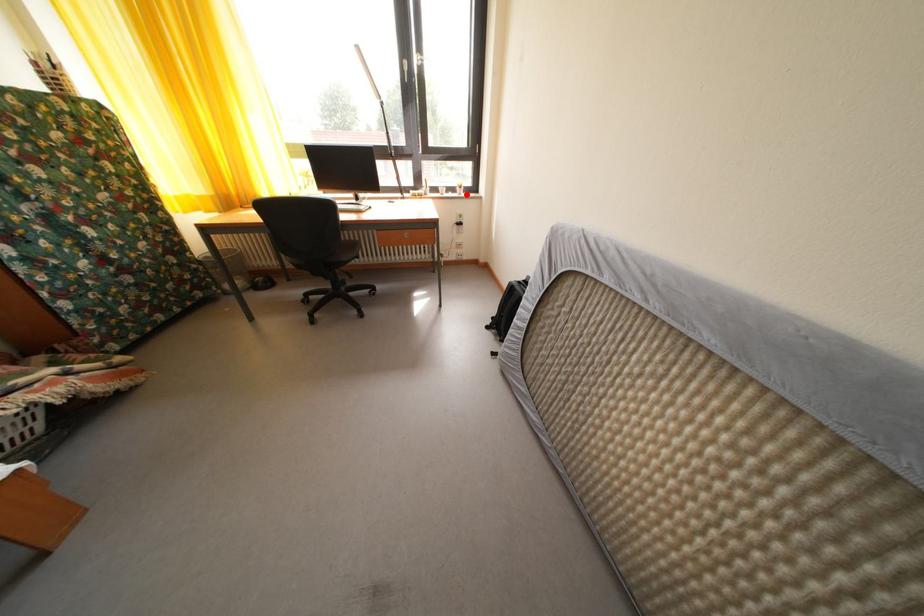
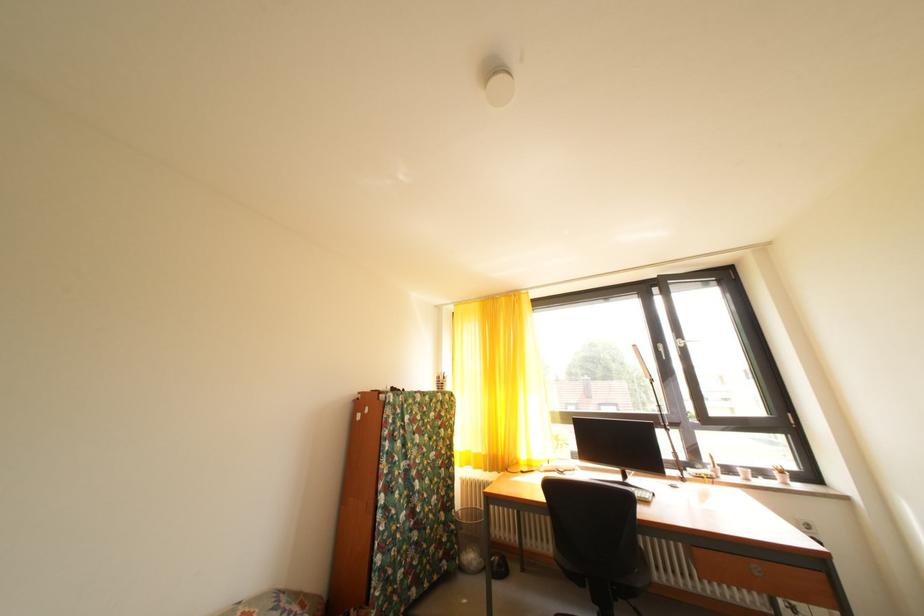
Question: A red point is marked in image1. In image2, is the corresponding 3D point closer to the camera or farther? Reply with the corresponding letter.

Choices:
 (A) The corresponding 3D point is closer.
 (B) The corresponding 3D point is farther.

Answer: (B)